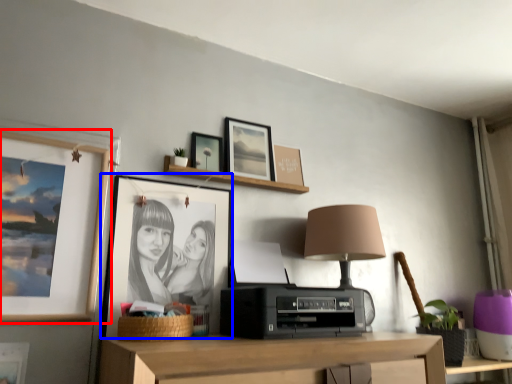
Question: Among these objects, which one is nearest to the camera, picture frame (highlighted by a red box) or picture frame (highlighted by a blue box)?

Choices:
 (A) picture frame
 (B) picture frame

Answer: (A)